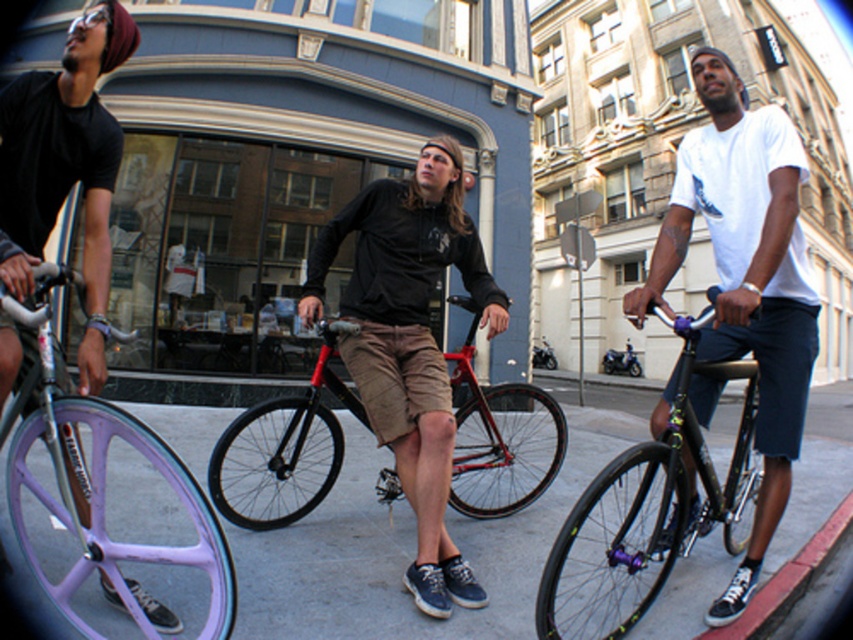
Find the location of `matte black hoodie at center`. matte black hoodie at center is located at coordinates (410, 342).

Is matte black hoodie at center taller than matte black bicycle at left?

Correct, matte black hoodie at center is much taller as matte black bicycle at left.

Which is behind, point (345, 304) or point (3, 124)?

Point (345, 304)

At what (x,y) coordinates should I click in order to perform the action: click on matte black hoodie at center. Please return your answer as a coordinate pair (x, y). This screenshot has height=640, width=853. Looking at the image, I should click on (410, 342).

Is matte black bicycle at left to the left of red matte bicycle at center from the viewer's perspective?

Correct, you'll find matte black bicycle at left to the left of red matte bicycle at center.

Does matte black bicycle at left have a larger size compared to red matte bicycle at center?

Incorrect, matte black bicycle at left is not larger than red matte bicycle at center.

Between point (22, 256) and point (268, 509), which one is positioned in front?

Point (22, 256) is more forward.

Find the location of a particular element. This screenshot has height=640, width=853. matte black bicycle at left is located at coordinates (64, 166).

Which is more to the right, white cotton t-shirt at center or matte black hoodie at center?

From the viewer's perspective, white cotton t-shirt at center appears more on the right side.

Between point (756, 294) and point (503, 305), which one is positioned in front?

Point (756, 294)

Where is `white cotton t-shirt at center`? Image resolution: width=853 pixels, height=640 pixels. white cotton t-shirt at center is located at coordinates (746, 278).